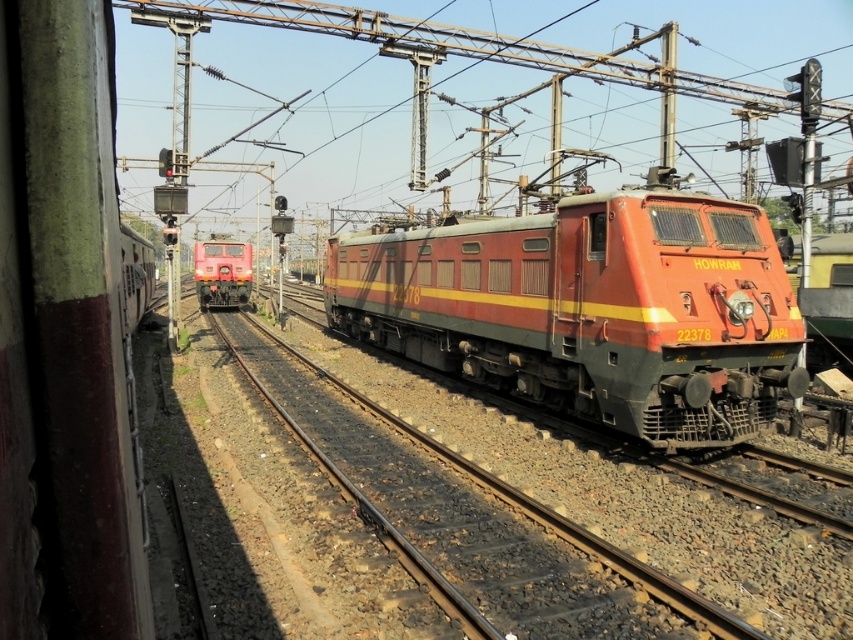
Question: Does metallic train track at center appear on the left side of matte red train at center?

Choices:
 (A) no
 (B) yes

Answer: (A)

Question: Which of these objects is positioned closest to the metallic train track at center?

Choices:
 (A) matte red train at center
 (B) matte red locomotive at center

Answer: (B)

Question: Is metallic train track at center further to camera compared to matte red train at center?

Choices:
 (A) no
 (B) yes

Answer: (A)

Question: Estimate the real-world distances between objects in this image. Which object is farther from the metallic train track at center?

Choices:
 (A) matte red locomotive at center
 (B) matte red train at center

Answer: (B)

Question: Which point is farther from the camera taking this photo?

Choices:
 (A) (432, 499)
 (B) (328, 308)

Answer: (B)

Question: Is matte red locomotive at center smaller than metallic train track at center?

Choices:
 (A) yes
 (B) no

Answer: (B)